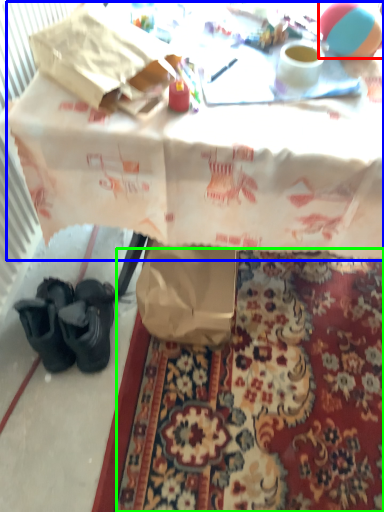
Question: Considering the real-world distances, which object is closest to ball (highlighted by a red box)? table (highlighted by a blue box) or mat (highlighted by a green box).

Choices:
 (A) table
 (B) mat

Answer: (A)